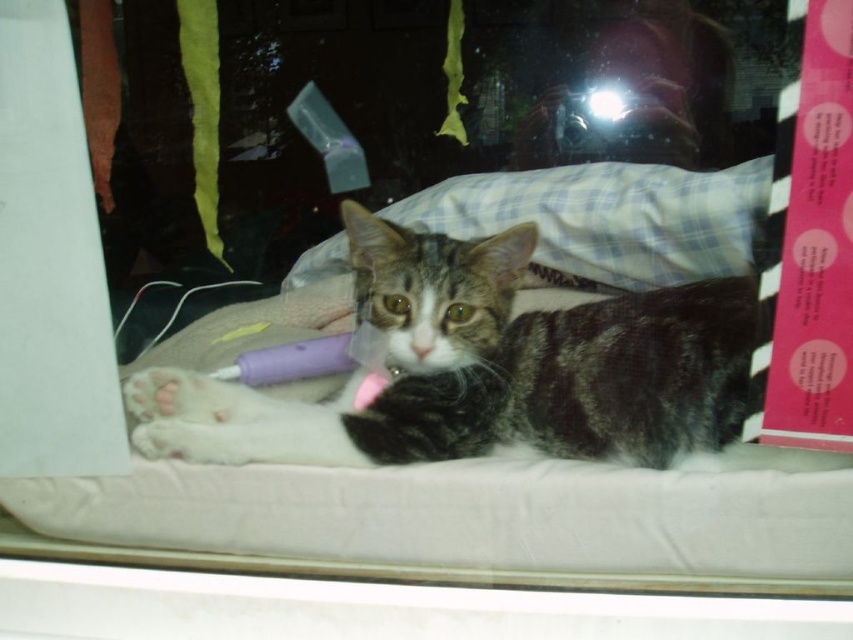
You are a delivery robot with a 12 inch wide package. You need to place the package between the tabby fur cat at center and the plaid fabric pillow at center. Is there enough space between them to fit the package?

The tabby fur cat at center and plaid fabric pillow at center are 11.77 inches apart from each other. Since the package is 12 inches wide, there isn not enough space to fit the package between them.

You are trying to place a new decorative pillow next to the tabby fur cat at center and the plaid fabric pillow at center. Based on their sizes, which one requires more space horizontally?

The plaid fabric pillow at center requires more space horizontally since the tabby fur cat at center has a lesser width compared to plaid fabric pillow at center.

You are a photographer setting up a shoot in the room. You want to position a small lamp so that it illuminates the tabby fur cat at center and the plaid fabric pillow at center equally. Based on their positions, where should you place the lamp relative to the cat and pillow?

Since the tabby fur cat at center is to the left of the plaid fabric pillow at center, placing the lamp directly between them would ensure equal illumination. Position the lamp in the middle point between the cat and the pillow so that both receive the same amount of light.